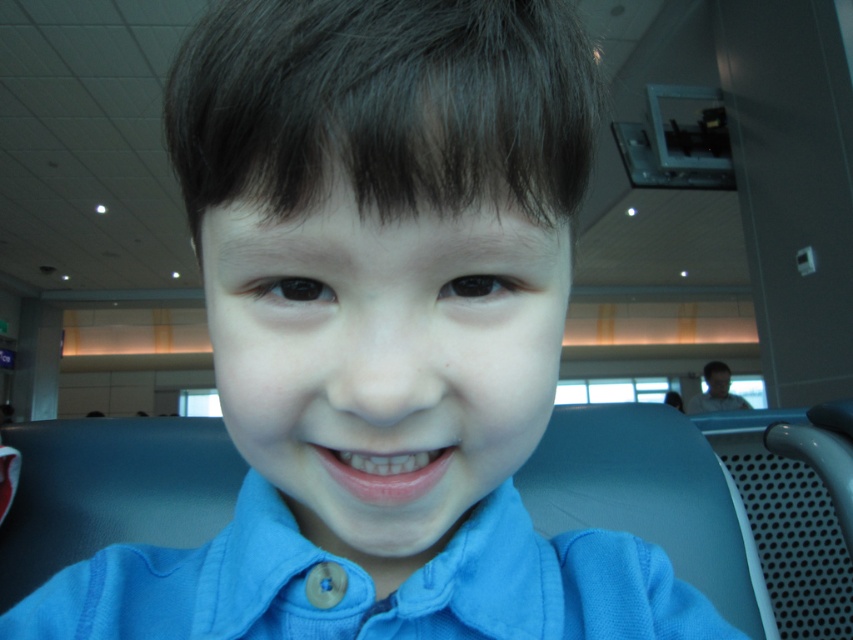
You are standing in an airport terminal and see the blue cotton dress shirt at center and the matte black face at upper right. If you want to take a photo that includes both objects in the frame, will you need to zoom in or zoom out?

The blue cotton dress shirt at center and the matte black face at upper right are 4.77 meters apart from each other. To include both in the frame, you would need to zoom out to widen the field of view, as they are relatively far apart.

You are a photographer standing in front of the blue cotton dress shirt at center. You want to take a closeup shot of it without moving the shirt. What is the minimum distance you should maintain to ensure the camera can focus properly?

The minimum distance you should maintain is 10.99 inches because the blue cotton dress shirt at center is positioned exactly at that distance from the viewer.

You are a photographer trying to capture the child in the blue cotton dress shirt at center and the matte black face at upper right in the same frame. Which object should you focus on first to ensure both are in the frame?

Since the blue cotton dress shirt at center is to the left of matte black face at upper right, you should focus on the blue cotton dress shirt at center first to ensure both are within the frame.